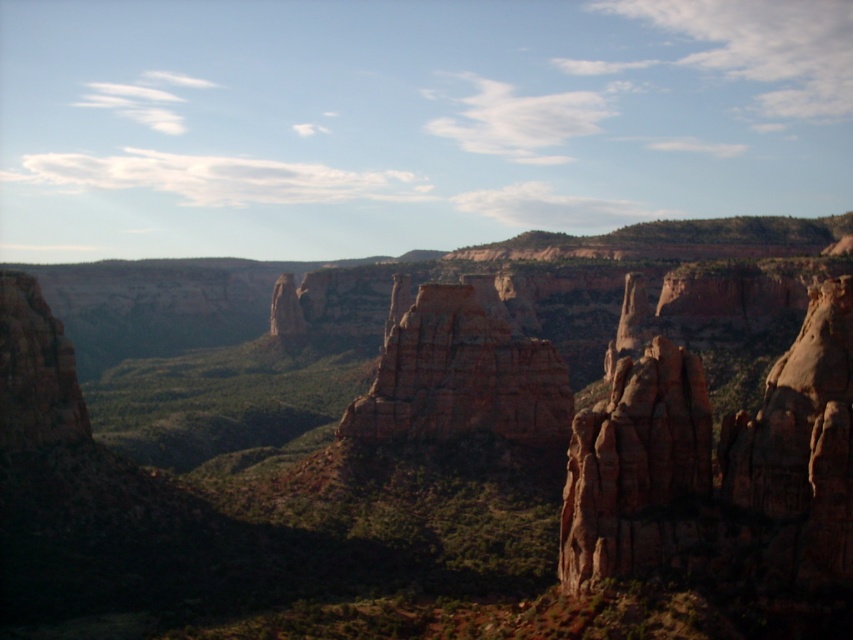
Is rustic sandstone rock formation at right smaller than rustic sandstone rock formation at center?

No, rustic sandstone rock formation at right is not smaller than rustic sandstone rock formation at center.

Does point (851, 570) come in front of point (357, 406)?

Yes.

Find the location of a particular element. The height and width of the screenshot is (640, 853). rustic sandstone rock formation at right is located at coordinates (718, 467).

This screenshot has width=853, height=640. Find the location of `rustic rock formation at center`. rustic rock formation at center is located at coordinates coord(456,449).

Does rustic rock formation at center have a lesser width compared to rustic sandstone rock formation at center?

In fact, rustic rock formation at center might be wider than rustic sandstone rock formation at center.

You are a GUI agent. You are given a task and a screenshot of the screen. Output one action in this format:
    pyautogui.click(x=<x>, y=<y>)
    Task: Click on the rustic rock formation at center
    
    Given the screenshot: What is the action you would take?
    pyautogui.click(x=456, y=449)

Between point (326, 561) and point (751, 576), which one is positioned in front?

Point (751, 576)

Who is shorter, rustic rock formation at center or rustic sandstone rock formation at right?

rustic sandstone rock formation at right

The width and height of the screenshot is (853, 640). In order to click on rustic rock formation at center in this screenshot , I will do `click(456, 449)`.

Identify the location of rustic rock formation at center. The width and height of the screenshot is (853, 640). (456, 449).